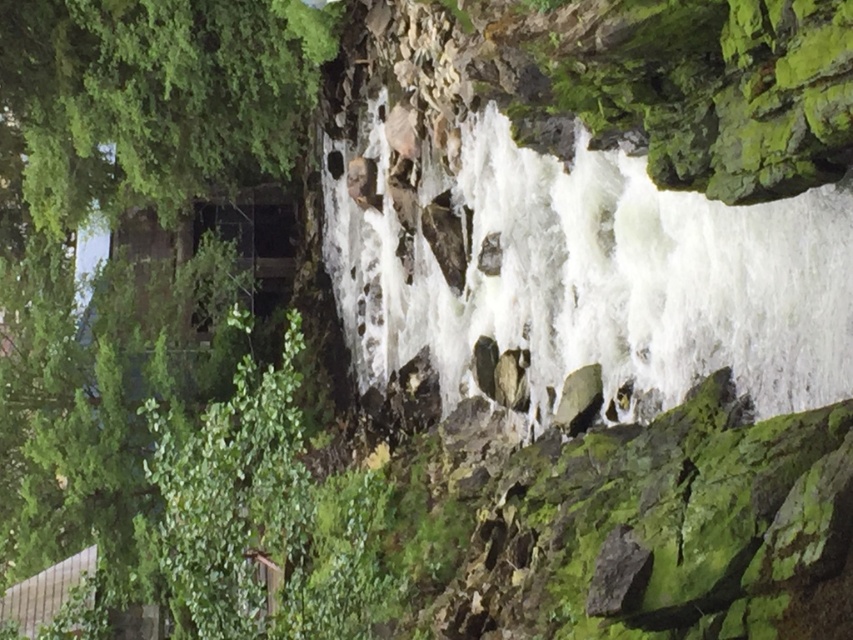
Question: Which object appears closest to the camera in this image?

Choices:
 (A) white frothy water at center
 (B) green leafy tree at left

Answer: (A)

Question: Which object is closer to the camera taking this photo?

Choices:
 (A) white frothy water at center
 (B) green leafy tree at left

Answer: (A)

Question: Which point is farther from the camera taking this photo?

Choices:
 (A) (51, 40)
 (B) (364, 248)

Answer: (B)

Question: Can you confirm if white frothy water at center is positioned above green leafy tree at left?

Choices:
 (A) yes
 (B) no

Answer: (B)

Question: Can you confirm if white frothy water at center is wider than green leafy tree at left?

Choices:
 (A) yes
 (B) no

Answer: (A)

Question: Can you confirm if white frothy water at center is positioned below green leafy tree at left?

Choices:
 (A) no
 (B) yes

Answer: (B)